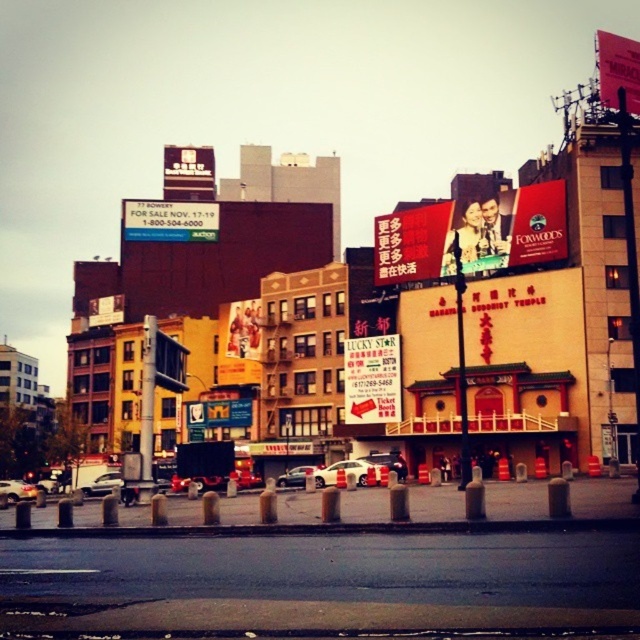
You are a delivery drone operator. Your drone needs to fly from the matte plastic billboard at center to the metallic sign at upper center. The drone has a maximum flight range of 150 feet. Can it make the trip without recharging?

The distance between the matte plastic billboard at center and the metallic sign at upper center is 168.49 feet, which exceeds the drone operator mentioned maximum flight range of 150 feet. Therefore, the drone cannot make the trip without recharging.

You are a delivery driver who needs to park your shiny silver sedan at center in a spot that can accommodate its height. The parking spot has a height restriction marked by the blue glossy sign at upper left. Can your car fit under the sign without hitting it?

The blue glossy sign at upper left is taller than the shiny silver sedan at center, so the car can fit under the sign without hitting it as long as the height restriction indicated by the sign allows for the car.

You are a delivery person who needs to hang a new advertisement. You have two options for placement spots. One is next to the matte plastic billboard at center, and the other is next to the metallic sign at upper center. Which spot would allow your advertisement to be placed higher up?

The metallic sign at upper center is taller than the matte plastic billboard at center, so placing the advertisement next to the metallic sign at upper center would allow it to be placed higher up.